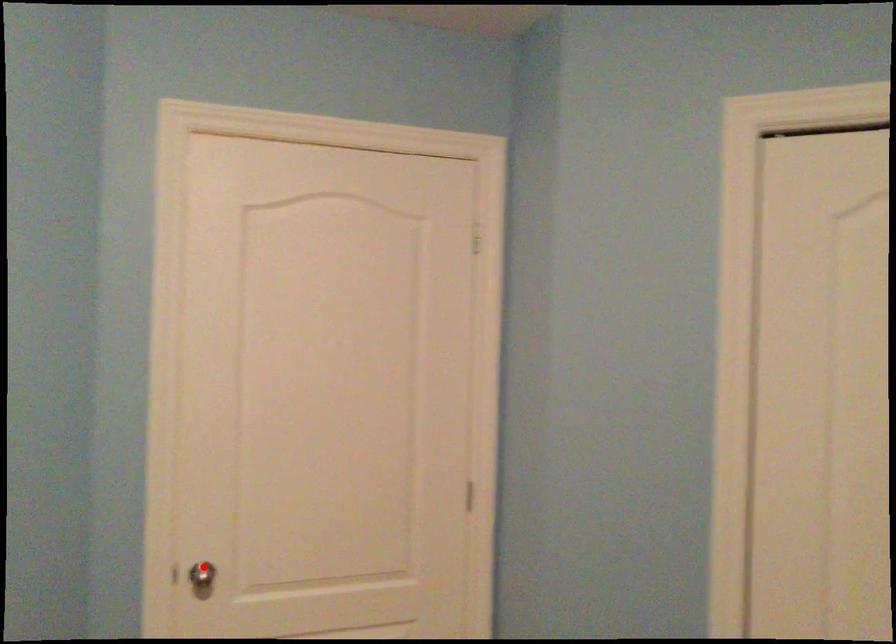
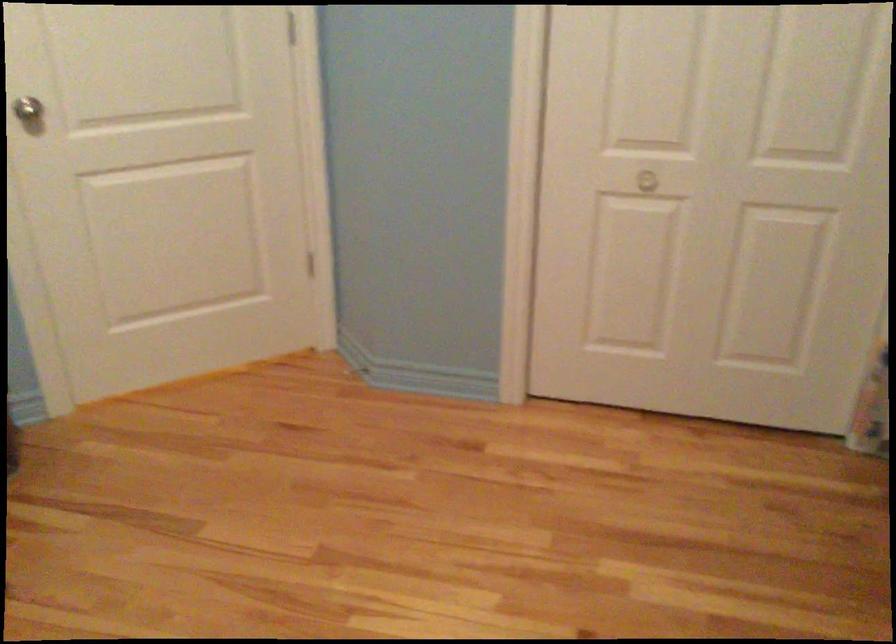
The point at the highlighted location is marked in the first image. Where is the corresponding point in the second image?

(29, 111)